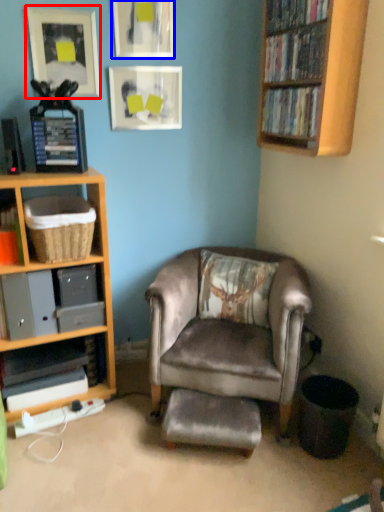
Question: Which of the following is the farthest to the observer, picture frame (highlighted by a red box) or picture frame (highlighted by a blue box)?

Choices:
 (A) picture frame
 (B) picture frame

Answer: (B)